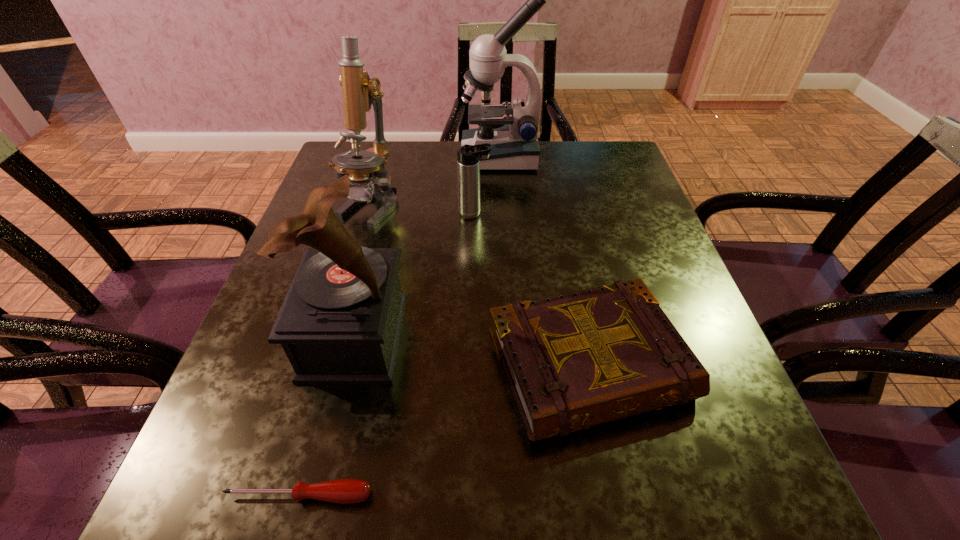
You are a GUI agent. You are given a task and a screenshot of the screen. Output one action in this format:
    pyautogui.click(x=<x>, y=<y>)
    Task: Click on the vacant space located 0.340m at the eyepiece of the farther microscope
    
    Given the screenshot: What is the action you would take?
    pyautogui.click(x=341, y=157)

Locate an element on the screen. blank space located 0.180m on the right of the left microscope is located at coordinates (471, 206).

The image size is (960, 540). I want to click on vacant space located 0.310m at the horn opening of the third tallest object, so click(574, 336).

The height and width of the screenshot is (540, 960). In order to click on vacant region located 0.070m on the handle side of the third shortest object in this screenshot , I will do `click(520, 213)`.

Locate an element on the screen. This screenshot has width=960, height=540. vacant space located on the left of the hardback book is located at coordinates (384, 366).

The width and height of the screenshot is (960, 540). I want to click on free location located 0.070m on the back of the nearest object, so click(x=316, y=435).

Where is `object present at the near edge`? The width and height of the screenshot is (960, 540). object present at the near edge is located at coordinates [x=343, y=491].

Where is `microscope that is at the left edge`? Image resolution: width=960 pixels, height=540 pixels. microscope that is at the left edge is located at coordinates (359, 92).

This screenshot has height=540, width=960. What are the coordinates of `phonograph_record situated at the left edge` in the screenshot? It's located at (340, 323).

Where is `screwdriver at the left edge`? screwdriver at the left edge is located at coordinates (343, 491).